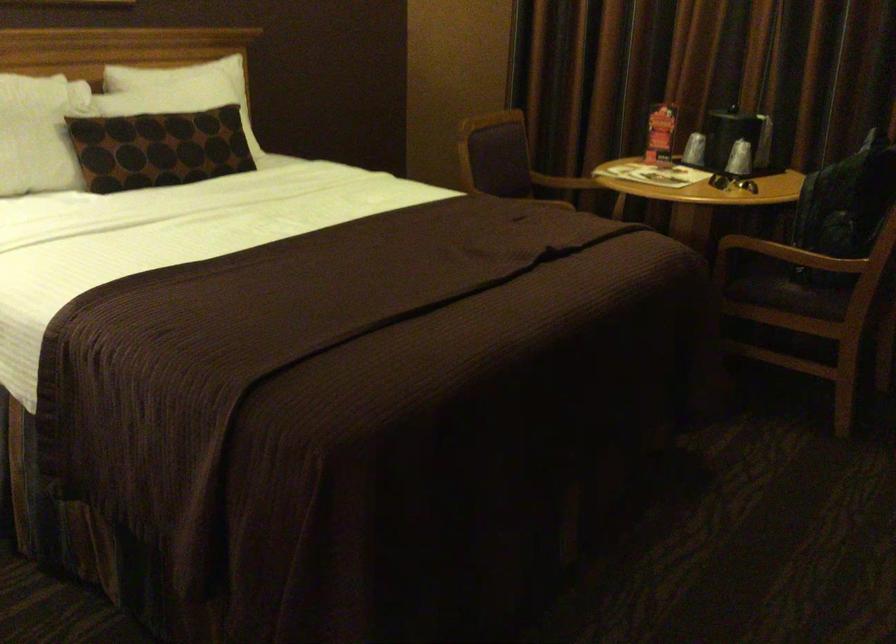
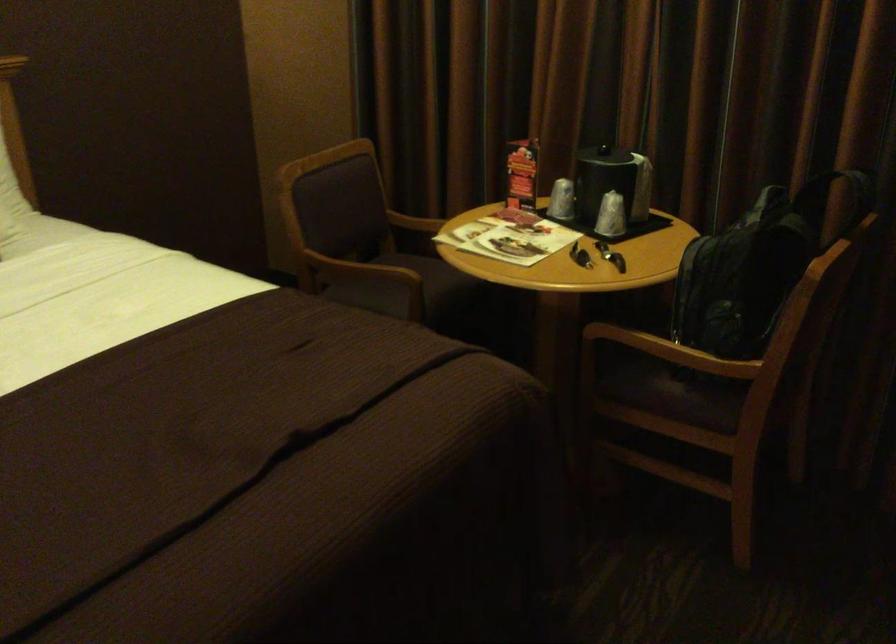
Where in the second image is the point corresponding to [695,147] from the first image?

(561, 200)